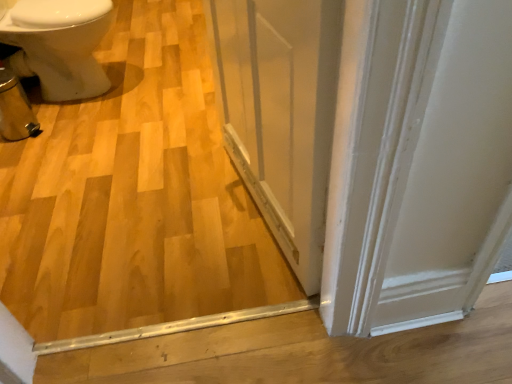
Question: Considering the relative sizes of white glossy bidet at left and transparent glass screen door at center in the image provided, is white glossy bidet at left thinner than transparent glass screen door at center?

Choices:
 (A) no
 (B) yes

Answer: (A)

Question: From a real-world perspective, is white glossy bidet at left on transparent glass screen door at center?

Choices:
 (A) no
 (B) yes

Answer: (A)

Question: Is white glossy bidet at left directly adjacent to transparent glass screen door at center?

Choices:
 (A) yes
 (B) no

Answer: (B)

Question: Is transparent glass screen door at center a part of white glossy bidet at left?

Choices:
 (A) yes
 (B) no

Answer: (B)

Question: Is white glossy bidet at left at the left side of transparent glass screen door at center?

Choices:
 (A) no
 (B) yes

Answer: (B)

Question: From a real-world perspective, is transparent glass screen door at center positioned above or below white glossy bidet at left?

Choices:
 (A) below
 (B) above

Answer: (B)

Question: Is transparent glass screen door at center inside the boundaries of white glossy bidet at left, or outside?

Choices:
 (A) outside
 (B) inside

Answer: (A)

Question: Is transparent glass screen door at center taller or shorter than white glossy bidet at left?

Choices:
 (A) short
 (B) tall

Answer: (B)

Question: From the image's perspective, is transparent glass screen door at center above or below white glossy bidet at left?

Choices:
 (A) above
 (B) below

Answer: (B)

Question: Is white glossy bidet at left to the left or to the right of natural wood floor at center in the image?

Choices:
 (A) left
 (B) right

Answer: (A)

Question: Is white glossy bidet at left taller or shorter than natural wood floor at center?

Choices:
 (A) tall
 (B) short

Answer: (A)

Question: From the image's perspective, is white glossy bidet at left above or below natural wood floor at center?

Choices:
 (A) below
 (B) above

Answer: (B)

Question: Does point pyautogui.click(x=79, y=38) appear closer or farther from the camera than point pyautogui.click(x=9, y=193)?

Choices:
 (A) farther
 (B) closer

Answer: (A)

Question: Is point (200, 86) positioned closer to the camera than point (336, 6)?

Choices:
 (A) farther
 (B) closer

Answer: (A)

Question: Do you think natural wood floor at center is within transparent glass screen door at center, or outside of it?

Choices:
 (A) outside
 (B) inside

Answer: (A)